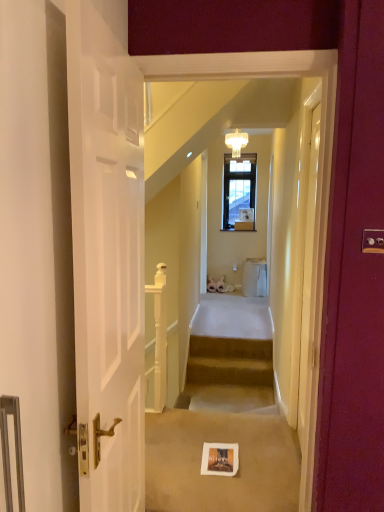
Identify the location of free spot above beige carpeted stairs at center (from a real-world perspective). (228, 360).